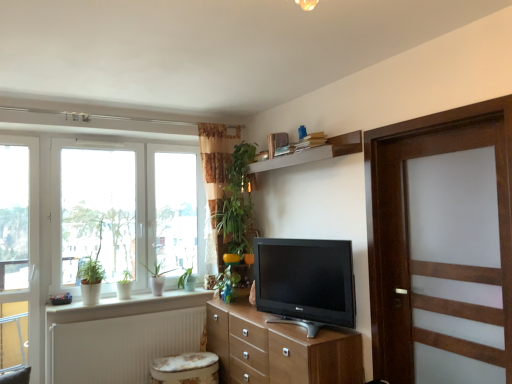
Question: From the image's perspective, is floral fabric music stool at lower center above wooden door at right?

Choices:
 (A) no
 (B) yes

Answer: (A)

Question: Is floral fabric music stool at lower center facing towards wooden door at right?

Choices:
 (A) yes
 (B) no

Answer: (B)

Question: Can you confirm if floral fabric music stool at lower center is taller than wooden door at right?

Choices:
 (A) yes
 (B) no

Answer: (B)

Question: Considering the relative sizes of floral fabric music stool at lower center and wooden door at right in the image provided, is floral fabric music stool at lower center smaller than wooden door at right?

Choices:
 (A) no
 (B) yes

Answer: (B)

Question: Is wooden door at right a part of floral fabric music stool at lower center?

Choices:
 (A) no
 (B) yes

Answer: (A)

Question: Is floral fabric music stool at lower center positioned in front of wooden door at right?

Choices:
 (A) no
 (B) yes

Answer: (A)

Question: From the image's perspective, is matte black tv at center below white ceramic pots at lower left?

Choices:
 (A) no
 (B) yes

Answer: (A)

Question: Is matte black tv at center at the right side of white ceramic pots at lower left?

Choices:
 (A) yes
 (B) no

Answer: (A)

Question: From the image's perspective, is matte black tv at center on white ceramic pots at lower left?

Choices:
 (A) yes
 (B) no

Answer: (A)

Question: Is matte black tv at center completely or partially outside of white ceramic pots at lower left?

Choices:
 (A) yes
 (B) no

Answer: (A)

Question: Does matte black tv at center have a larger size compared to white ceramic pots at lower left?

Choices:
 (A) no
 (B) yes

Answer: (B)

Question: Does matte black tv at center have a lesser height compared to white ceramic pots at lower left?

Choices:
 (A) yes
 (B) no

Answer: (B)

Question: Is wooden door at right shorter than white ceramic pots at lower left?

Choices:
 (A) no
 (B) yes

Answer: (A)